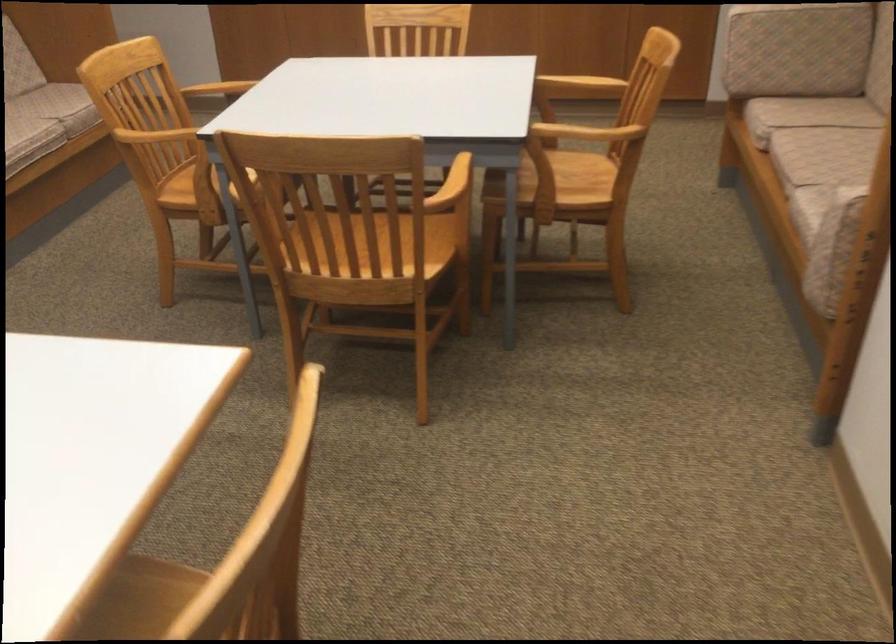
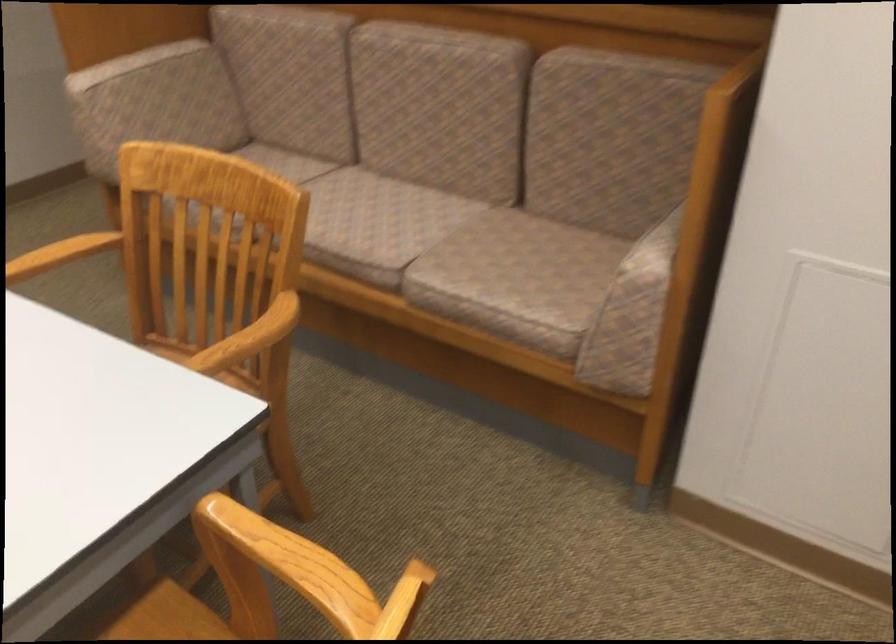
The point at (586, 125) is marked in the first image. Where is the corresponding point in the second image?

(248, 339)